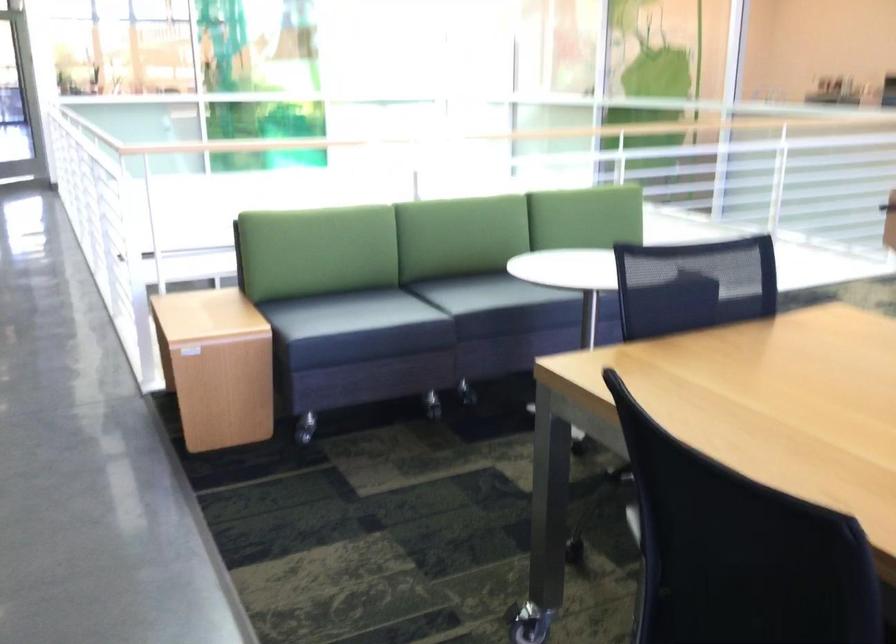
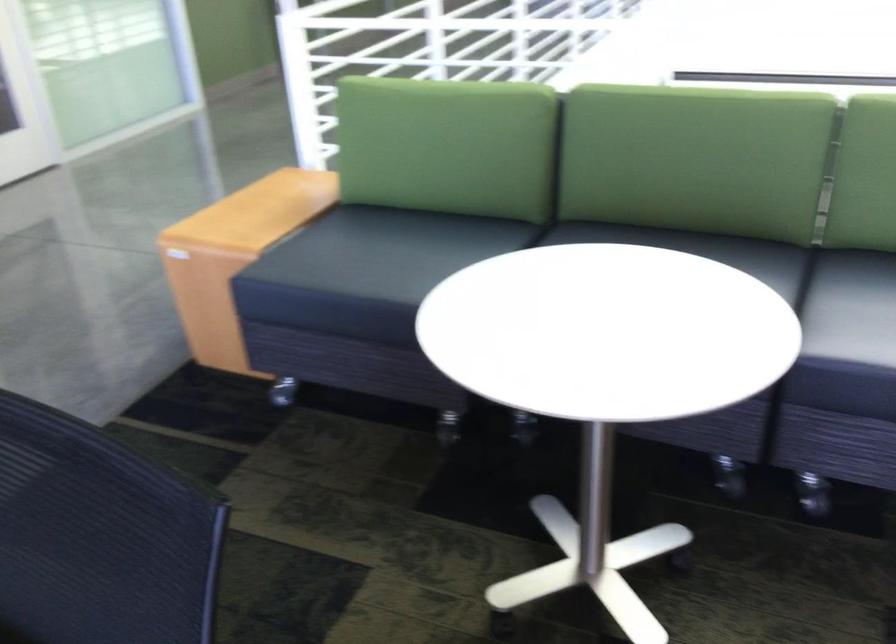
Question: I am providing you with two images of the same scene from different viewpoints. Which of the following objects are not visible in image2?

Choices:
 (A) black sofa sitting surface
 (B) sofa sitting surface
 (C) soap pump dispenser
 (D) wooden sofa armrest

Answer: (B)